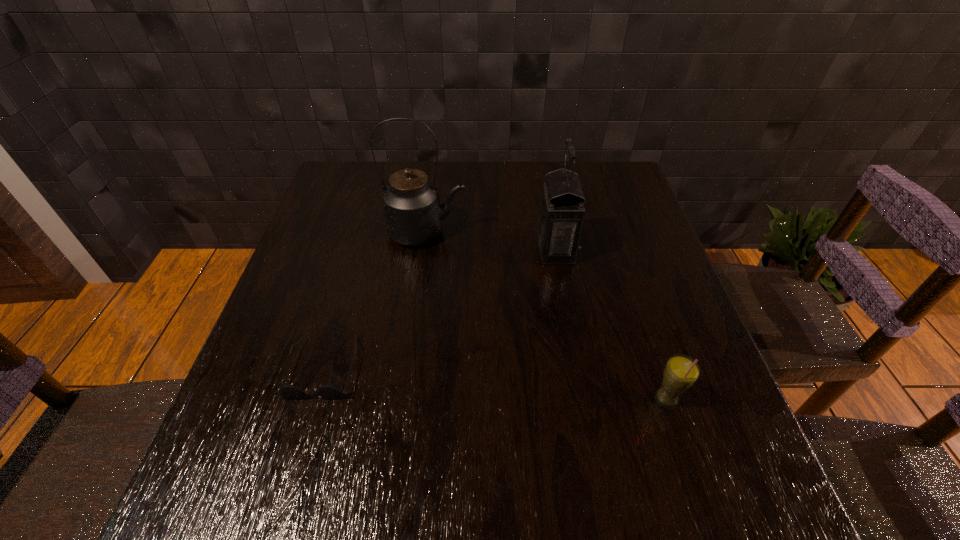
Image resolution: width=960 pixels, height=540 pixels. Identify the location of vacant region between the shortest object and the kettle. (374, 300).

You are a GUI agent. You are given a task and a screenshot of the screen. Output one action in this format:
    pyautogui.click(x=<x>, y=<y>)
    Task: Click on the empty space that is in between the kettle and the second shortest object
    
    Given the screenshot: What is the action you would take?
    pyautogui.click(x=546, y=316)

You are a GUI agent. You are given a task and a screenshot of the screen. Output one action in this format:
    pyautogui.click(x=<x>, y=<y>)
    Task: Click on the vacant region between the kettle and the straw for drinking
    
    Given the screenshot: What is the action you would take?
    pyautogui.click(x=546, y=316)

Identify the location of free space between the rightmost object and the shortest object. This screenshot has height=540, width=960. (495, 383).

This screenshot has width=960, height=540. Identify the location of blank region between the kettle and the second shortest object. (546, 316).

Where is `vacant space in between the lantern and the kettle`? Image resolution: width=960 pixels, height=540 pixels. vacant space in between the lantern and the kettle is located at coordinates (491, 241).

Locate an element on the screen. The height and width of the screenshot is (540, 960). vacant area between the third tallest object and the third object from left to right is located at coordinates (611, 325).

Image resolution: width=960 pixels, height=540 pixels. In order to click on unoccupied area between the rightmost object and the second object from right to left in this screenshot , I will do click(611, 325).

Locate which object is the third closest to the kettle. Please provide its 2D coordinates. Your answer should be formatted as a tuple, i.e. [(x, y)], where the tuple contains the x and y coordinates of a point satisfying the conditions above.

[(681, 372)]

Identify the location of object that stands as the closest to the lantern. The width and height of the screenshot is (960, 540). (413, 215).